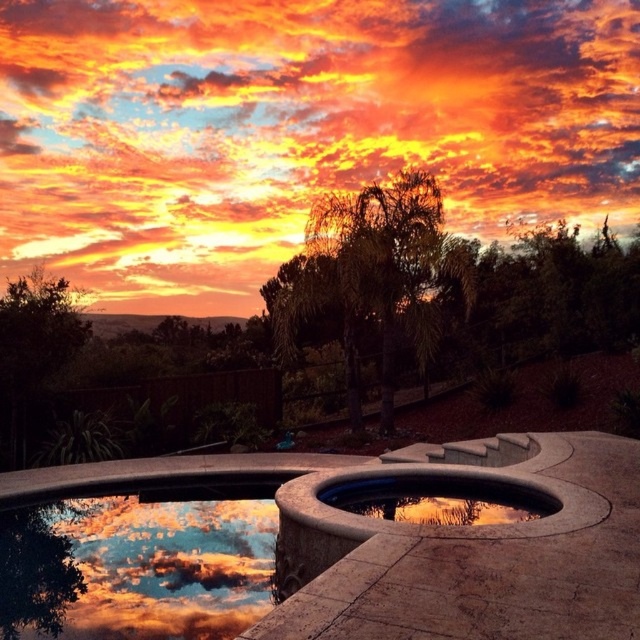
Find the location of `orange cotton cloud at upper center`. orange cotton cloud at upper center is located at coordinates (296, 129).

Which is more to the left, orange cotton cloud at upper center or smooth concrete pool at center?

orange cotton cloud at upper center

Locate an element on the screen. This screenshot has width=640, height=640. orange cotton cloud at upper center is located at coordinates (296, 129).